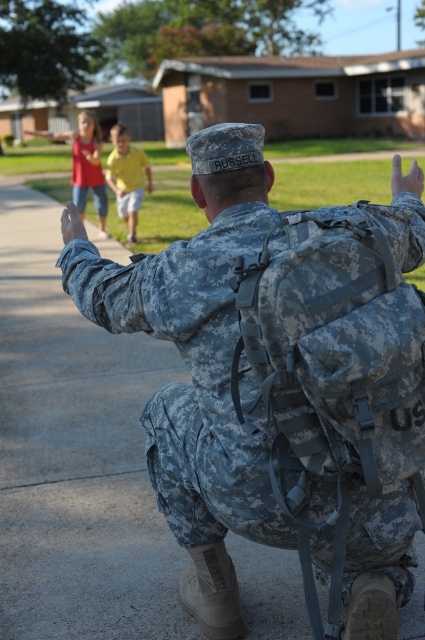
You are a photographer trying to capture a photo of the yellow matte shirt at center and the matte camouflage uniform at upper left. Based on their positions, which one is located to the right of the other?

The yellow matte shirt at center is positioned on the right side of the matte camouflage uniform at upper left.

You are a photographer taking a picture of the scene. You notice two camouflage uniforms in the image. Which one, the camouflage fabric uniform at center or the matte camouflage uniform at upper left, is taller in the photo?

The camouflage fabric uniform at center is taller than the matte camouflage uniform at upper left.

You are a photographer trying to capture a photo of both the yellow matte shirt at center and the matte camouflage uniform at upper left. Based on their positions, which one will appear larger in the photo?

The yellow matte shirt at center will appear larger in the photo because it is closer to the viewer than the matte camouflage uniform at upper left.